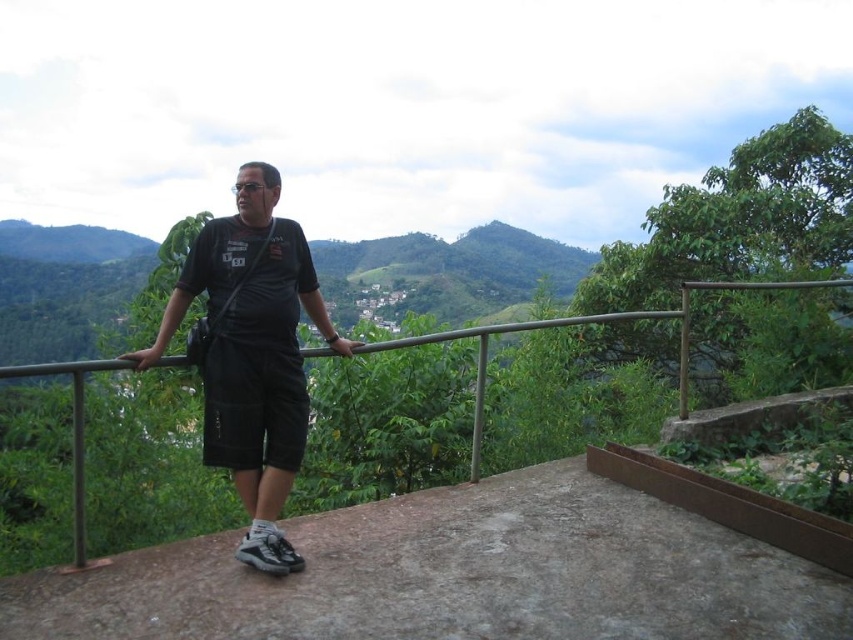
Question: Does matte black shirt at center appear on the right side of metal/rustic rail at center?

Choices:
 (A) yes
 (B) no

Answer: (B)

Question: Is matte black shirt at center below metal/rustic rail at center?

Choices:
 (A) no
 (B) yes

Answer: (A)

Question: Does matte black shirt at center have a greater width compared to metal/rustic rail at center?

Choices:
 (A) no
 (B) yes

Answer: (A)

Question: Among these points, which one is farthest from the camera?

Choices:
 (A) (73, 513)
 (B) (263, 436)

Answer: (B)

Question: Among these points, which one is nearest to the camera?

Choices:
 (A) (285, 292)
 (B) (563, 321)

Answer: (A)